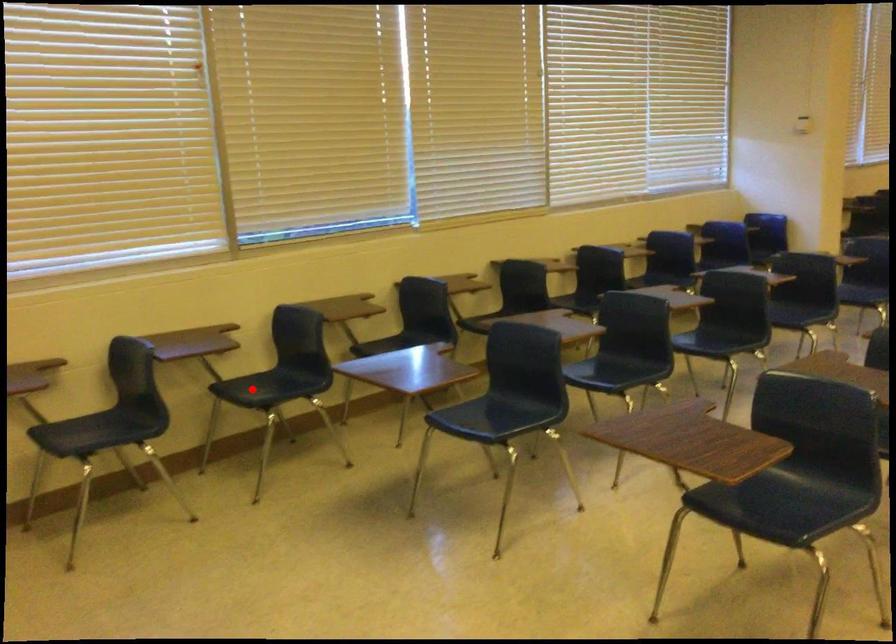
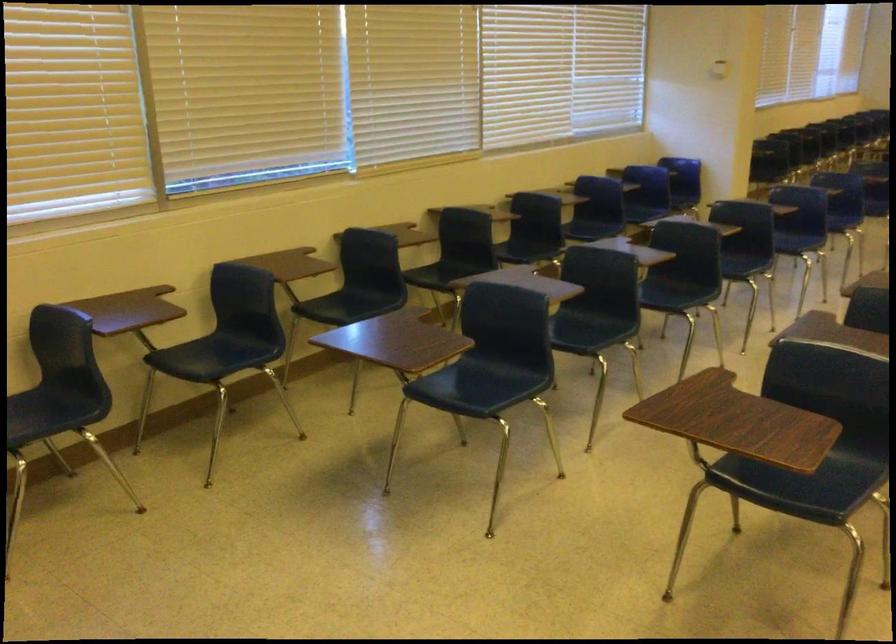
Find the pixel in the second image that matches the highlighted location in the first image.

(196, 359)